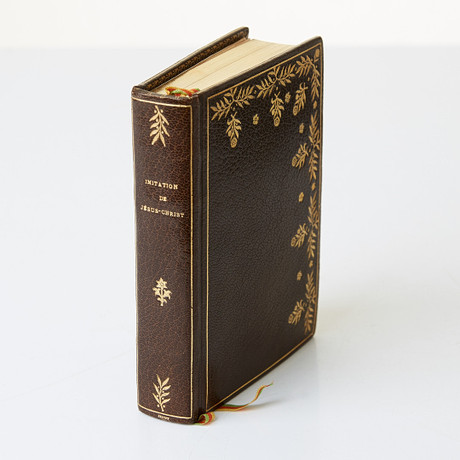
The height and width of the screenshot is (460, 460). In order to click on book pages in this screenshot , I will do `click(243, 55)`.